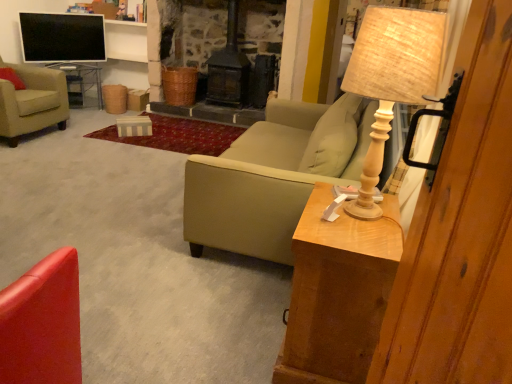
Question: Is wooden beige table lamp at right aimed at metal mesh table at left, marked as the first table in a left-to-right arrangement?

Choices:
 (A) yes
 (B) no

Answer: (B)

Question: Is metal mesh table at left, positioned as the 2th table in bottom-to-top order, surrounded by wooden beige table lamp at right?

Choices:
 (A) yes
 (B) no

Answer: (B)

Question: Is wooden beige table lamp at right oriented away from metal mesh table at left, the first table when ordered from back to front?

Choices:
 (A) no
 (B) yes

Answer: (A)

Question: From a real-world perspective, is wooden beige table lamp at right physically above metal mesh table at left, marked as the first table in a left-to-right arrangement?

Choices:
 (A) yes
 (B) no

Answer: (A)

Question: Is wooden beige table lamp at right completely or partially outside of metal mesh table at left, marked as the first table in a left-to-right arrangement?

Choices:
 (A) yes
 (B) no

Answer: (A)

Question: Is wooden beige table lamp at right closer to the viewer compared to metal mesh table at left, the first table when ordered from back to front?

Choices:
 (A) yes
 (B) no

Answer: (A)

Question: Considering the relative sizes of flat screen tv at upper left and beige fabric armchair at left, the 2th chair when ordered from front to back, in the image provided, is flat screen tv at upper left shorter than beige fabric armchair at left, the 2th chair when ordered from front to back,?

Choices:
 (A) no
 (B) yes

Answer: (B)

Question: From the image's perspective, does flat screen tv at upper left appear lower than beige fabric armchair at left, placed as the first chair when sorted from left to right?

Choices:
 (A) yes
 (B) no

Answer: (B)

Question: Does flat screen tv at upper left appear on the right side of beige fabric armchair at left, placed as the first chair when sorted from left to right?

Choices:
 (A) yes
 (B) no

Answer: (A)

Question: Is flat screen tv at upper left positioned behind beige fabric armchair at left, positioned as the first chair in back-to-front order?

Choices:
 (A) no
 (B) yes

Answer: (B)

Question: Could you tell me if flat screen tv at upper left is facing beige fabric armchair at left, marked as the second chair in a right-to-left arrangement?

Choices:
 (A) yes
 (B) no

Answer: (B)

Question: From the image's perspective, is flat screen tv at upper left on top of beige fabric armchair at left, positioned as the first chair in back-to-front order?

Choices:
 (A) no
 (B) yes

Answer: (B)

Question: Is the position of beige fabric armchair at left, marked as the second chair in a right-to-left arrangement, less distant than that of shiny red chair at lower left, the first chair when ordered from bottom to top?

Choices:
 (A) no
 (B) yes

Answer: (A)